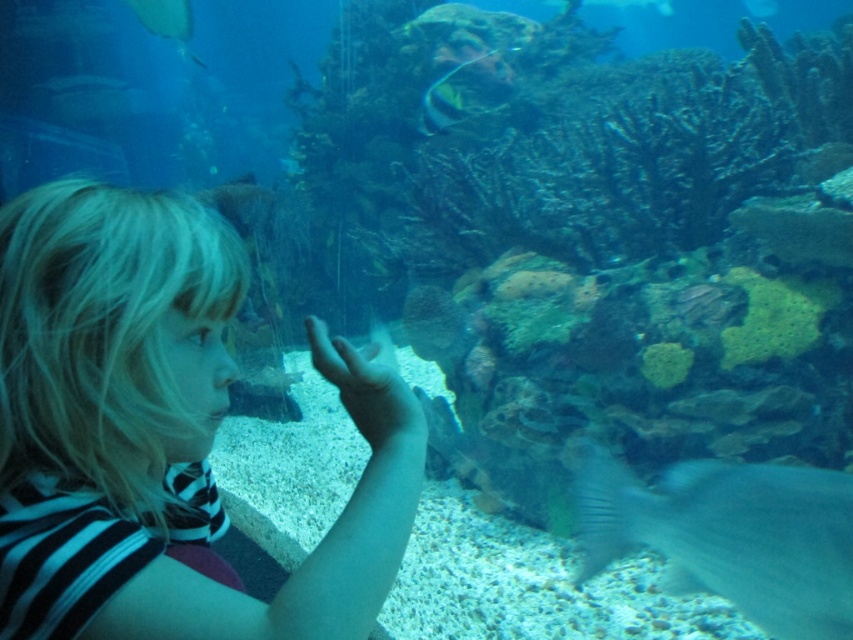
Which of these two, blonde hair at left or translucent glass fish at upper right, stands shorter?

Standing shorter between the two is translucent glass fish at upper right.

In the scene shown: Is blonde hair at left bigger than translucent glass fish at upper right?

Correct, blonde hair at left is larger in size than translucent glass fish at upper right.

Does point (270, 636) come behind point (758, 4)?

No, (270, 636) is in front of (758, 4).

The image size is (853, 640). What are the coordinates of `blonde hair at left` in the screenshot? It's located at (160, 429).

You are a GUI agent. You are given a task and a screenshot of the screen. Output one action in this format:
    pyautogui.click(x=<x>, y=<y>)
    Task: Click on the shiny silver fish at upper center
    
    Given the screenshot: What is the action you would take?
    pyautogui.click(x=463, y=92)

In the scene shown: Can you confirm if shiny silver fish at upper center is positioned to the right of shiny silver fish at upper left?

Indeed, shiny silver fish at upper center is positioned on the right side of shiny silver fish at upper left.

Image resolution: width=853 pixels, height=640 pixels. I want to click on shiny silver fish at upper center, so click(x=463, y=92).

Which of these two, blonde hair at left or shiny silver fish at upper center, stands shorter?

blonde hair at left is shorter.

In the scene shown: Does blonde hair at left have a lesser width compared to shiny silver fish at upper center?

Yes, blonde hair at left is thinner than shiny silver fish at upper center.

Which is in front, point (349, 637) or point (432, 83)?

Positioned in front is point (349, 637).

Identify the location of blonde hair at left. (160, 429).